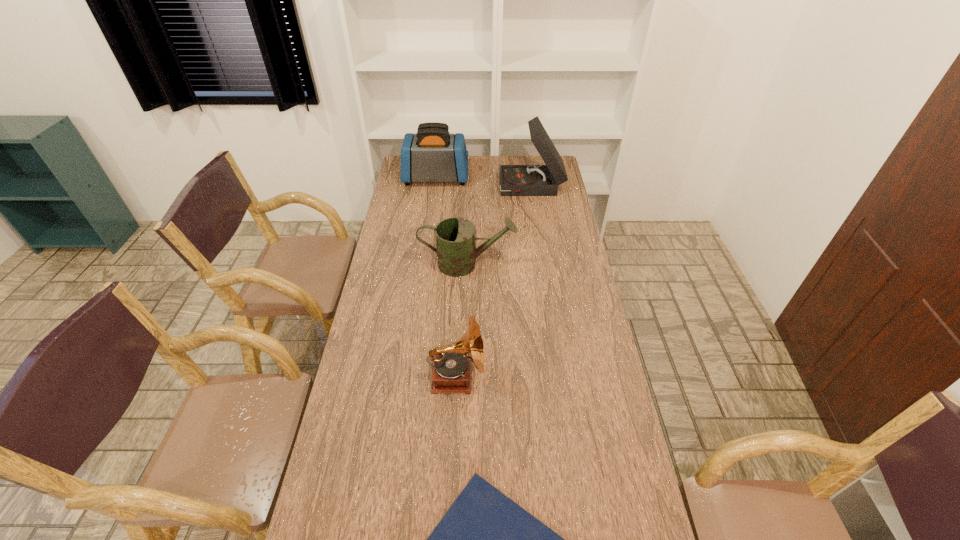
I want to click on the taller phonograph_record, so click(x=515, y=180).

Locate an element on the screen. This screenshot has width=960, height=540. the farther phonograph_record is located at coordinates tap(515, 180).

Locate an element on the screen. This screenshot has height=540, width=960. toaster is located at coordinates (432, 154).

Find the location of a particular element. The height and width of the screenshot is (540, 960). the shorter phonograph_record is located at coordinates (452, 369).

Locate an element on the screen. the left phonograph_record is located at coordinates (452, 369).

You are a GUI agent. You are given a task and a screenshot of the screen. Output one action in this format:
    pyautogui.click(x=<x>, y=<y>)
    Task: Click on the watering can
    
    Given the screenshot: What is the action you would take?
    pyautogui.click(x=456, y=250)

Find the location of a particular element. the third nearest object is located at coordinates (456, 250).

The image size is (960, 540). Find the location of `free region located 0.330m on the front-facing side of the right phonograph_record`. free region located 0.330m on the front-facing side of the right phonograph_record is located at coordinates (434, 188).

Locate an element on the screen. Image resolution: width=960 pixels, height=540 pixels. vacant space located on the front-facing side of the right phonograph_record is located at coordinates (427, 188).

The image size is (960, 540). Identify the location of vacant space located 0.210m on the front-facing side of the right phonograph_record. (458, 188).